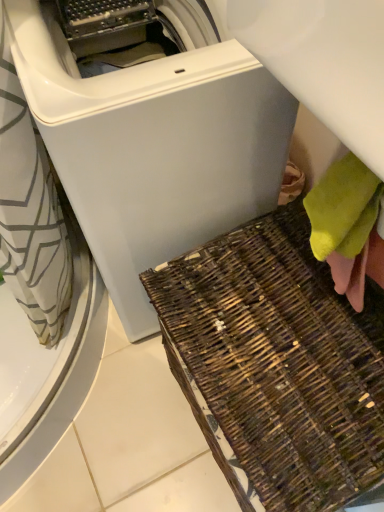
Describe the element at coordinates (280, 361) in the screenshot. The height and width of the screenshot is (512, 384). I see `brown woven basket at lower right` at that location.

You are a GUI agent. You are given a task and a screenshot of the screen. Output one action in this format:
    pyautogui.click(x=<x>, y=<y>)
    Task: Click on the brown woven basket at lower right
    Image resolution: width=384 pixels, height=512 pixels.
    Given the screenshot: What is the action you would take?
    pyautogui.click(x=280, y=361)

Locate an element on the screen. soft yellow towel at lower right is located at coordinates (348, 226).

Where is `washing machine beneath the soft yellow towel at lower right (from a real-world perspective)`? The height and width of the screenshot is (512, 384). washing machine beneath the soft yellow towel at lower right (from a real-world perspective) is located at coordinates (131, 155).

From the image's perspective, is white matte washing machine at center located above soft yellow towel at lower right?

Indeed, from the image's perspective, white matte washing machine at center is shown above soft yellow towel at lower right.

Considering the relative positions of white matte washing machine at center and soft yellow towel at lower right in the image provided, is white matte washing machine at center to the right of soft yellow towel at lower right from the viewer's perspective?

Incorrect, white matte washing machine at center is not on the right side of soft yellow towel at lower right.

How far apart are white matte washing machine at center and soft yellow towel at lower right?

white matte washing machine at center is 12.47 inches from soft yellow towel at lower right.

From a real-world perspective, who is located higher, brown woven basket at lower right or soft yellow towel at lower right?

soft yellow towel at lower right is physically above.

Considering the relative sizes of brown woven basket at lower right and soft yellow towel at lower right in the image provided, is brown woven basket at lower right smaller than soft yellow towel at lower right?

Incorrect, brown woven basket at lower right is not smaller in size than soft yellow towel at lower right.

Is brown woven basket at lower right thinner than soft yellow towel at lower right?

No, brown woven basket at lower right is not thinner than soft yellow towel at lower right.

Is soft yellow towel at lower right far away from brown woven basket at lower right?

That's not correct — soft yellow towel at lower right is a little close to brown woven basket at lower right.

Which object is closer to the camera taking this photo, soft yellow towel at lower right or brown woven basket at lower right?

brown woven basket at lower right.

Could you tell me if soft yellow towel at lower right is turned towards brown woven basket at lower right?

No, soft yellow towel at lower right does not turn towards brown woven basket at lower right.

At what (x,y) coordinates should I click in order to perform the action: click on bath towel located behind the white matte washing machine at center. Please return your answer as a coordinate pair (x, y). The height and width of the screenshot is (512, 384). Looking at the image, I should click on (348, 226).

Which is behind, point (340, 269) or point (142, 132)?

The point (340, 269) is farther.

Is soft yellow towel at lower right next to white matte washing machine at center?

They are not placed beside each other.

Looking at this image, is soft yellow towel at lower right oriented towards white matte washing machine at center?

No, soft yellow towel at lower right is not facing towards white matte washing machine at center.

From a real-world perspective, is white matte washing machine at center located higher than brown woven basket at lower right?

Yes, from a real-world perspective, white matte washing machine at center is above brown woven basket at lower right.

In the scene shown: From the image's perspective, is white matte washing machine at center above or below brown woven basket at lower right?

white matte washing machine at center is above brown woven basket at lower right.

Is white matte washing machine at center inside or outside of brown woven basket at lower right?

white matte washing machine at center exists outside the volume of brown woven basket at lower right.

Is white matte washing machine at center turned away from brown woven basket at lower right?

white matte washing machine at center is not turned away from brown woven basket at lower right.

Considering their positions, is brown woven basket at lower right located in front of or behind white matte washing machine at center?

Visually, brown woven basket at lower right is located behind white matte washing machine at center.

From a real-world perspective, which object stands above the other?

From a 3D spatial view, white matte washing machine at center is above.

Can you confirm if brown woven basket at lower right is shorter than white matte washing machine at center?

Result: Yes.

You are a GUI agent. You are given a task and a screenshot of the screen. Output one action in this format:
    pyautogui.click(x=<x>, y=<y>)
    Task: Click on the bath towel above the white matte washing machine at center (from a real-world perspective)
    The width and height of the screenshot is (384, 512).
    Given the screenshot: What is the action you would take?
    click(348, 226)

At what (x,y) coordinates should I click in order to perform the action: click on bath towel on the right of brown woven basket at lower right. Please return your answer as a coordinate pair (x, y). Looking at the image, I should click on (348, 226).

In the scene shown: Estimate the real-world distances between objects in this image. Which object is further from brown woven basket at lower right, white matte washing machine at center or soft yellow towel at lower right?

white matte washing machine at center.

Based on their spatial positions, is brown woven basket at lower right or white matte washing machine at center closer to soft yellow towel at lower right?

brown woven basket at lower right is closer to soft yellow towel at lower right.

Which object lies further to the anchor point white matte washing machine at center, soft yellow towel at lower right or brown woven basket at lower right?

soft yellow towel at lower right is positioned further to the anchor white matte washing machine at center.

Which object lies further to the anchor point brown woven basket at lower right, soft yellow towel at lower right or white matte washing machine at center?

The object further to brown woven basket at lower right is white matte washing machine at center.

Estimate the real-world distances between objects in this image. Which object is further from white matte washing machine at center, brown woven basket at lower right or soft yellow towel at lower right?

Among the two, soft yellow towel at lower right is located further to white matte washing machine at center.

Estimate the real-world distances between objects in this image. Which object is further from soft yellow towel at lower right, white matte washing machine at center or brown woven basket at lower right?

white matte washing machine at center lies further to soft yellow towel at lower right than the other object.

This screenshot has height=512, width=384. In order to click on bath towel that lies between white matte washing machine at center and brown woven basket at lower right from top to bottom in this screenshot , I will do `click(348, 226)`.